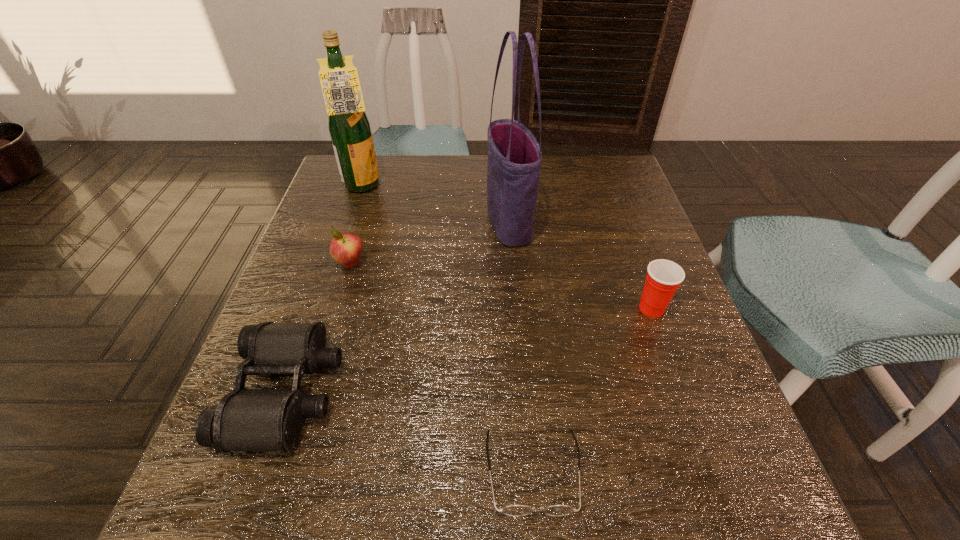
Image resolution: width=960 pixels, height=540 pixels. In order to click on vacant space located on the back of the third farthest object in this screenshot , I will do `click(380, 167)`.

Find the location of a particular element. The image size is (960, 540). free spot located through the eyepieces of the second shortest object is located at coordinates (526, 392).

Image resolution: width=960 pixels, height=540 pixels. In order to click on tote bag that is at the far edge in this screenshot , I will do `click(514, 156)`.

Image resolution: width=960 pixels, height=540 pixels. What are the coordinates of `liquor located at the far edge` in the screenshot? It's located at (349, 127).

At what (x,y) coordinates should I click in order to perform the action: click on object that is positioned at the near edge. Please return your answer as a coordinate pair (x, y). The height and width of the screenshot is (540, 960). Looking at the image, I should click on (513, 510).

At what (x,y) coordinates should I click in order to perform the action: click on liquor that is at the left edge. Please return your answer as a coordinate pair (x, y). The width and height of the screenshot is (960, 540). Looking at the image, I should click on point(349,127).

You are a GUI agent. You are given a task and a screenshot of the screen. Output one action in this format:
    pyautogui.click(x=<x>, y=<y>)
    Task: Click on the apple positioned at the left edge
    
    Given the screenshot: What is the action you would take?
    pyautogui.click(x=345, y=248)

In order to click on binoculars present at the left edge in this screenshot , I will do `click(245, 419)`.

The width and height of the screenshot is (960, 540). Find the location of `object that is positioned at the right edge`. object that is positioned at the right edge is located at coordinates (663, 277).

This screenshot has width=960, height=540. In order to click on object located in the far left corner section of the desktop in this screenshot , I will do `click(349, 127)`.